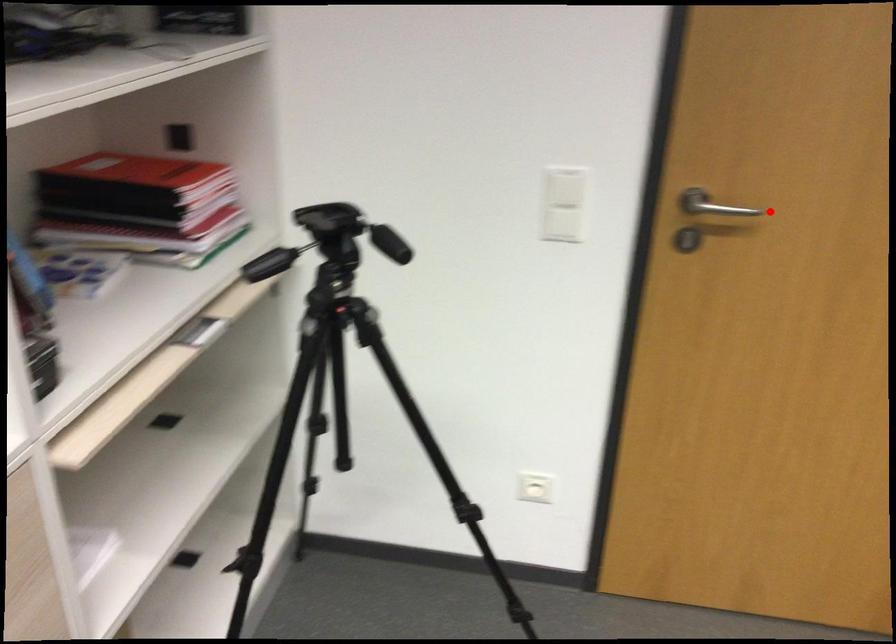
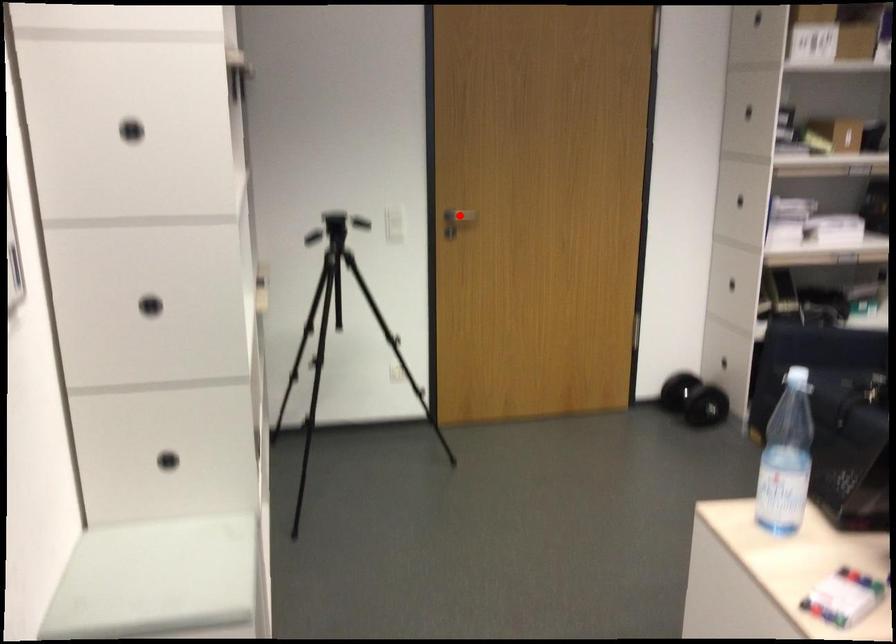
I am providing you with two images of the same scene from different viewpoints. A red point is marked on the first image and another point is marked on the second image. Do the highlighted points in image1 and image2 indicate the same real-world spot?

Yes